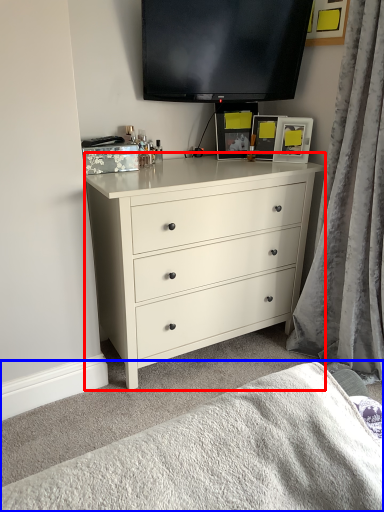
Question: Which point is closer to the camera, chest of drawers (highlighted by a red box) or bedding (highlighted by a blue box)?

Choices:
 (A) chest of drawers
 (B) bedding

Answer: (B)